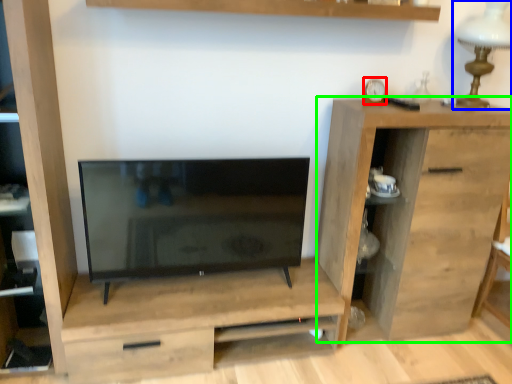
Question: Which object is the closest to the clock (highlighted by a red box)? Choose among these: table lamp (highlighted by a blue box) or chest of drawers (highlighted by a green box).

Choices:
 (A) table lamp
 (B) chest of drawers

Answer: (A)